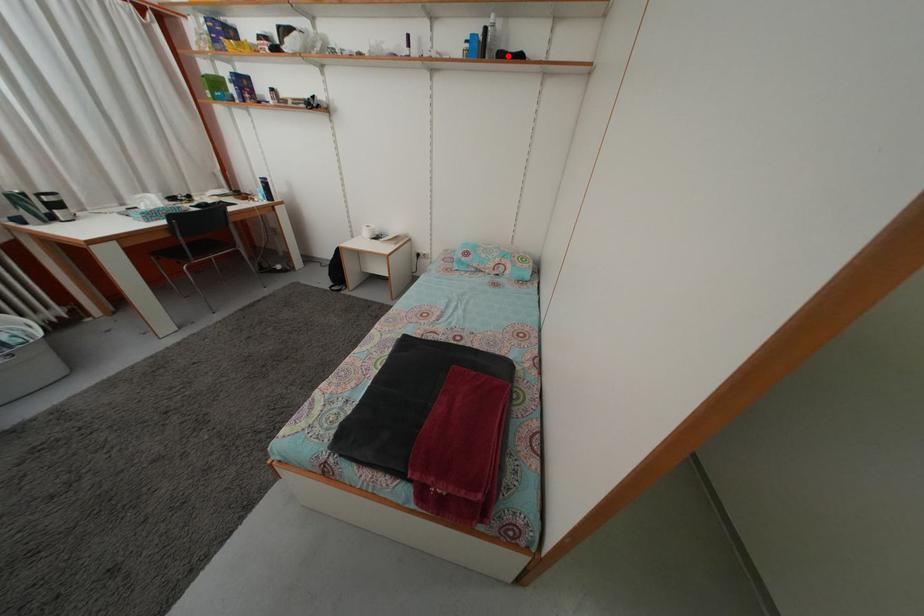
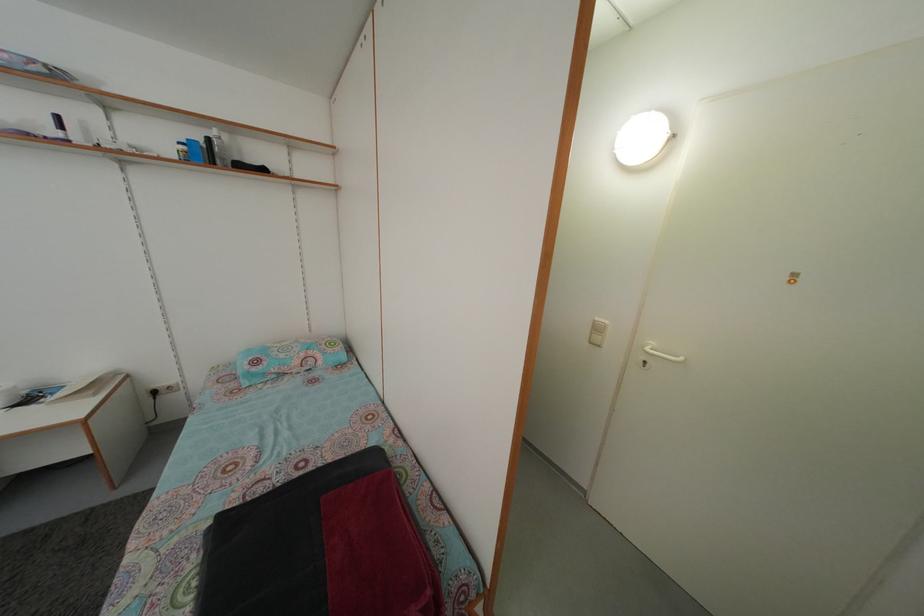
Locate, in the second image, the point that corresponds to the highlighted location in the first image.

(242, 166)